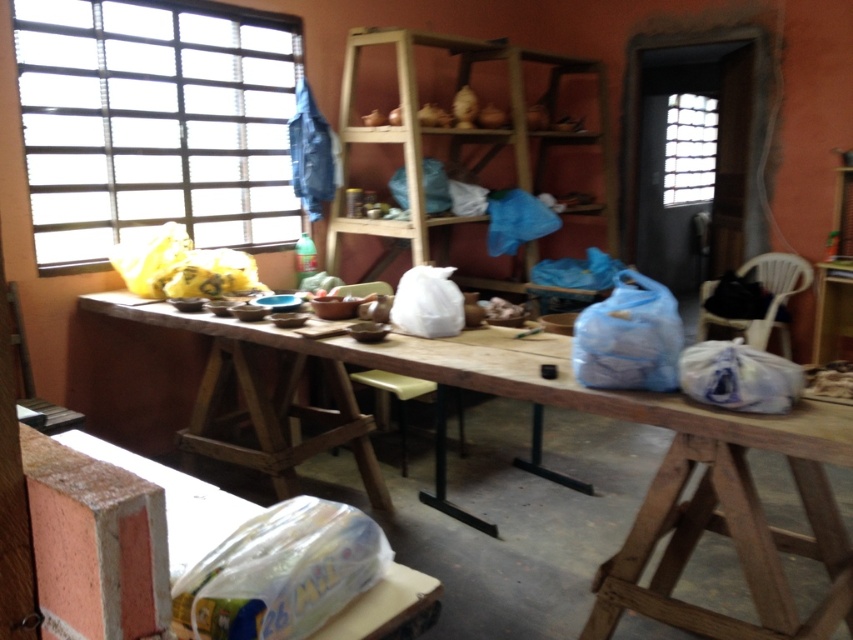
You are standing in the pottery studio and see two points marked on the wall. The first point is at coordinates point (436, 225) and the second is at point (711, 189). Which point is closer to you?

Point (436, 225) is in front of point (711, 189), so it is closer to you.